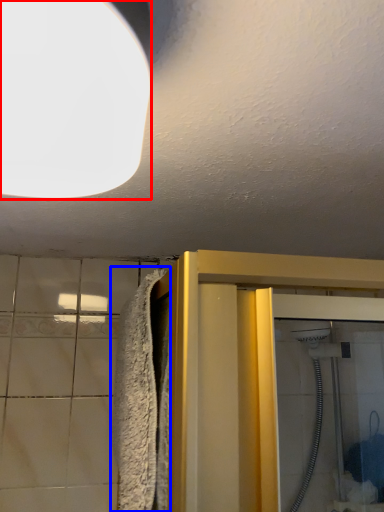
Question: Which point is further to the camera, lighting (highlighted by a red box) or bath towel (highlighted by a blue box)?

Choices:
 (A) lighting
 (B) bath towel

Answer: (B)